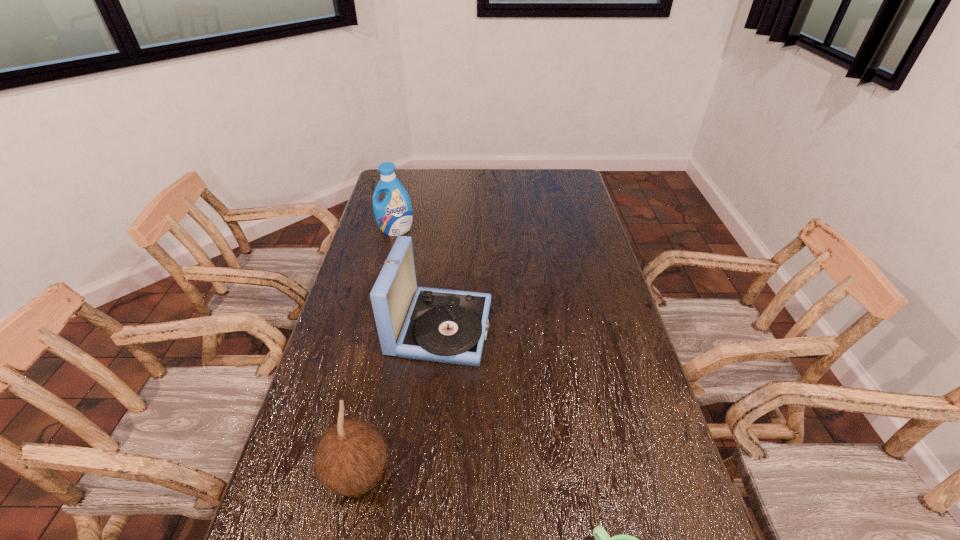
Where is `vacant space that satisfies the following two spatial constraints: 1. on the front side of the phonograph record; 2. on the surface of the second nearest object`? This screenshot has height=540, width=960. vacant space that satisfies the following two spatial constraints: 1. on the front side of the phonograph record; 2. on the surface of the second nearest object is located at coordinates (427, 474).

The image size is (960, 540). I want to click on vacant point that satisfies the following two spatial constraints: 1. on the front-facing side of the detergent; 2. on the left side of the phonograph record, so click(372, 328).